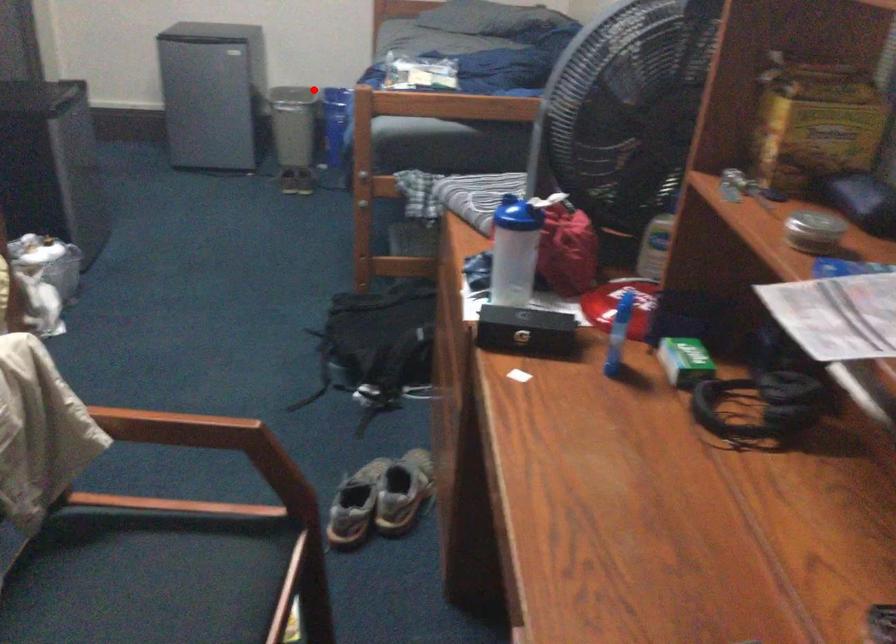
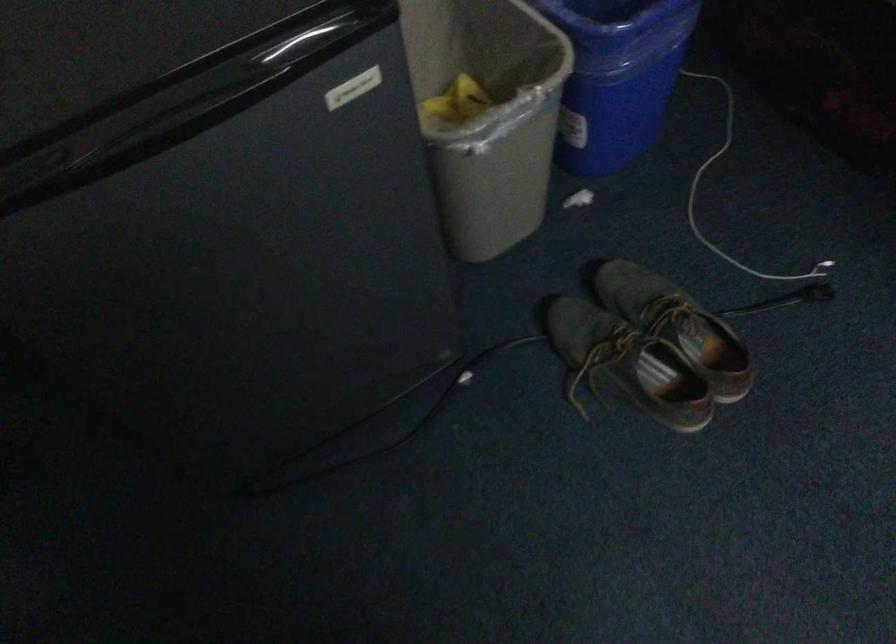
Question: I am providing you with two images of the same scene from different viewpoints. In image1, a red point is highlighted. Considering the same 3D point in image2, which of the following is correct?

Choices:
 (A) It is closer
 (B) It is farther

Answer: (A)